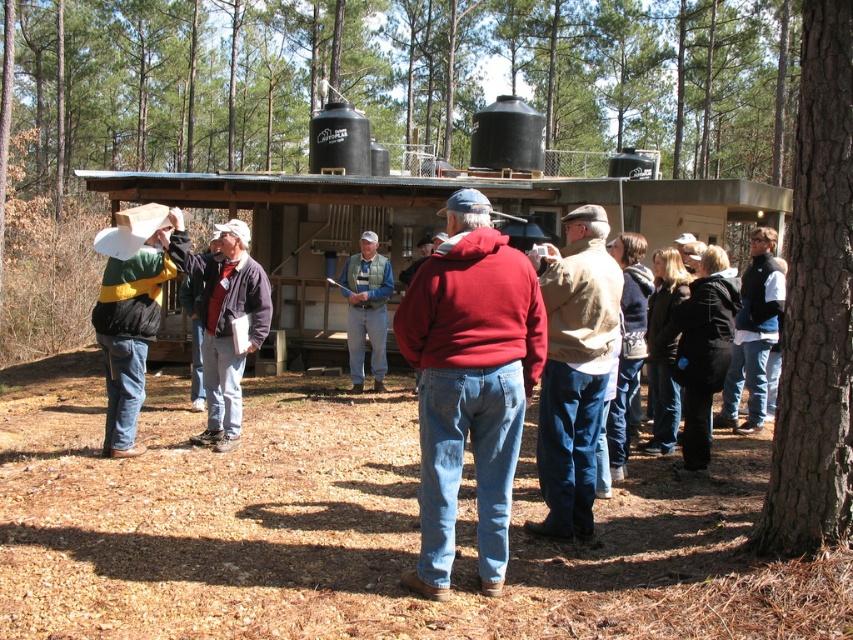
Is point (372, 88) positioned behind point (587, 371)?

Yes, it is behind point (587, 371).

Who is taller, brown bark tree at center or beige sweater at center?

With more height is brown bark tree at center.

I want to click on brown bark tree at center, so click(x=363, y=99).

Locate an element on the screen. This screenshot has height=640, width=853. brown bark tree at center is located at coordinates (363, 99).

Is red matte hoodie at center below black fleece jacket at right?

Correct, red matte hoodie at center is located below black fleece jacket at right.

Measure the distance between point (492,285) and camera.

They are 13.86 feet apart.

Find the location of a particular element. The width and height of the screenshot is (853, 640). red matte hoodie at center is located at coordinates (469, 384).

What do you see at coordinates (816, 305) in the screenshot?
I see `smooth brown bark at right` at bounding box center [816, 305].

Which of these two, smooth brown bark at right or matte black jacket at center, stands taller?

Standing taller between the two is smooth brown bark at right.

Identify the location of smooth brown bark at right. (816, 305).